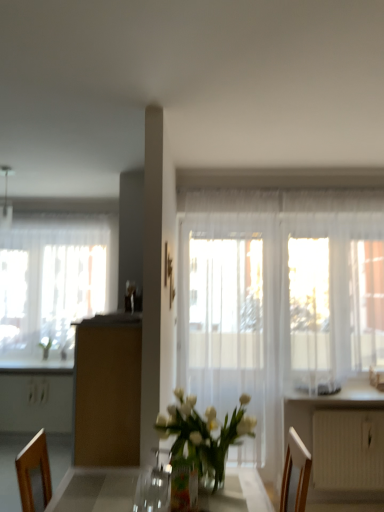
At what (x,y) coordinates should I click in order to perform the action: click on metallic silver lamp at upper left. Please return your answer as a coordinate pair (x, y). Image resolution: width=384 pixels, height=512 pixels. Looking at the image, I should click on (6, 201).

What is the approximate width of white textured radiator at lower right?

3.72 inches.

This screenshot has width=384, height=512. I want to click on white textured radiator at lower right, so click(348, 450).

Image resolution: width=384 pixels, height=512 pixels. What do you see at coordinates (107, 390) in the screenshot? I see `brown matte cabinet at center` at bounding box center [107, 390].

Measure the distance between translucent fabric screen door at center and camera.

translucent fabric screen door at center and camera are 10.46 feet apart from each other.

In order to face translucent glass vase at center, should I rotate leftwards or rightwards?

Turn left approximately 0.604 degrees to face it.

Measure the distance between wooden picture frame at center and camera.

A distance of 2.46 meters exists between wooden picture frame at center and camera.

Image resolution: width=384 pixels, height=512 pixels. What do you see at coordinates (341, 394) in the screenshot? I see `white glossy counter top at lower right` at bounding box center [341, 394].

At what (x,y) coordinates should I click in order to perform the action: click on white glossy counter top at lower right. Please return your answer as a coordinate pair (x, y). The image size is (384, 512). Looking at the image, I should click on (341, 394).

Identify the location of metallic silver lamp at upper left. (6, 201).

Would you say white textured radiator at lower right is a long distance from translucent glass vase at center?

Yes, white textured radiator at lower right and translucent glass vase at center are located far from each other.

Considering the sizes of objects white textured radiator at lower right and translucent glass vase at center in the image provided, who is thinner, white textured radiator at lower right or translucent glass vase at center?

translucent glass vase at center.

Is white textured radiator at lower right taller or shorter than translucent glass vase at center?

white textured radiator at lower right is taller than translucent glass vase at center.

From a real-world perspective, is white textured radiator at lower right physically below translucent glass vase at center?

Yes.

Can we say white glossy counter top at lower right lies outside wooden picture frame at center?

Absolutely, white glossy counter top at lower right is external to wooden picture frame at center.

Which is more to the right, white glossy counter top at lower right or wooden picture frame at center?

From the viewer's perspective, white glossy counter top at lower right appears more on the right side.

In terms of width, does white glossy counter top at lower right look wider or thinner when compared to wooden picture frame at center?

In the image, white glossy counter top at lower right appears to be wider than wooden picture frame at center.

Is metallic silver lamp at upper left positioned with its back to translucent fabric screen door at center?

That's not correct — metallic silver lamp at upper left is not looking away from translucent fabric screen door at center.

Which is in front, metallic silver lamp at upper left or translucent fabric screen door at center?

translucent fabric screen door at center is in front.

From the image's perspective, is metallic silver lamp at upper left above or below translucent fabric screen door at center?

From the image's perspective, metallic silver lamp at upper left appears above translucent fabric screen door at center.

Based on the photo, is metallic silver lamp at upper left beside translucent fabric screen door at center?

They are not placed beside each other.

Is metallic silver lamp at upper left not near white glossy counter top at lower right?

Absolutely, metallic silver lamp at upper left is distant from white glossy counter top at lower right.

From a real-world perspective, who is located lower, metallic silver lamp at upper left or white glossy counter top at lower right?

white glossy counter top at lower right, from a real-world perspective.

Could you tell me if metallic silver lamp at upper left is turned towards white glossy counter top at lower right?

No, metallic silver lamp at upper left is not facing towards white glossy counter top at lower right.

Is the position of metallic silver lamp at upper left less distant than that of white glossy counter top at lower right?

No, metallic silver lamp at upper left is further to the viewer.

Looking at the image, does translucent fabric screen door at center seem bigger or smaller compared to brown matte cabinet at center?

In the image, translucent fabric screen door at center appears to be smaller than brown matte cabinet at center.

Which is in front, point (195, 377) or point (93, 441)?

Positioned in front is point (93, 441).

In the image, is translucent fabric screen door at center on the left side or the right side of brown matte cabinet at center?

translucent fabric screen door at center is positioned on brown matte cabinet at center's right side.

In the scene shown: Is translucent fabric screen door at center far from brown matte cabinet at center?

Yes, translucent fabric screen door at center is far from brown matte cabinet at center.

Considering their positions, is brown matte cabinet at center located in front of or behind wooden picture frame at center?

In the image, brown matte cabinet at center appears in front of wooden picture frame at center.

From a real-world perspective, which object stands above the other?

In real-world perspective, wooden picture frame at center is above.

Which object is positioned more to the right, brown matte cabinet at center or wooden picture frame at center?

From the viewer's perspective, wooden picture frame at center appears more on the right side.

Is brown matte cabinet at center beside wooden picture frame at center?

No, brown matte cabinet at center is not next to wooden picture frame at center.

Which is correct: translucent glass window at left is inside white textured radiator at lower right, or outside of it?

translucent glass window at left exists outside the volume of white textured radiator at lower right.

Is white textured radiator at lower right at the back of translucent glass window at left?

No, translucent glass window at left is not facing the opposite direction of white textured radiator at lower right.

Between translucent glass window at left and white textured radiator at lower right, which one has smaller size?

white textured radiator at lower right.

Are translucent glass window at left and white textured radiator at lower right far apart?

That's right, there is a large distance between translucent glass window at left and white textured radiator at lower right.

At what (x,y) coordinates should I click in order to perform the action: click on radiator beneath the translucent glass vase at center (from a real-world perspective). Please return your answer as a coordinate pair (x, y). The image size is (384, 512). Looking at the image, I should click on (348, 450).

Find the location of a particular element. The width and height of the screenshot is (384, 512). counter top below the wooden picture frame at center (from the image's perspective) is located at coordinates (341, 394).

From the image, which object appears to be nearer to brown matte cabinet at center, translucent glass vase at center or white textured radiator at lower right?

The object closer to brown matte cabinet at center is translucent glass vase at center.

Consider the image. When comparing their distances from white textured radiator at lower right, does translucent fabric screen door at center or brown matte cabinet at center seem closer?

translucent fabric screen door at center.

Estimate the real-world distances between objects in this image. Which object is further from white textured radiator at lower right, metallic silver lamp at upper left or translucent glass vase at center?

metallic silver lamp at upper left.

When comparing their distances from wooden picture frame at center, does metallic silver lamp at upper left or white textured radiator at lower right seem closer?

metallic silver lamp at upper left lies closer to wooden picture frame at center than the other object.

Looking at the image, which one is located closer to translucent glass vase at center, wooden picture frame at center or metallic silver lamp at upper left?

The object closer to translucent glass vase at center is wooden picture frame at center.

Estimate the real-world distances between objects in this image. Which object is further from brown matte cabinet at center, translucent fabric screen door at center or white glossy counter top at lower right?

white glossy counter top at lower right.

Based on their spatial positions, is translucent glass window at left or brown matte cabinet at center further from metallic silver lamp at upper left?

brown matte cabinet at center is further to metallic silver lamp at upper left.

Estimate the real-world distances between objects in this image. Which object is further from metallic silver lamp at upper left, white glossy counter top at lower right or brown matte cabinet at center?

Based on the image, white glossy counter top at lower right appears to be further to metallic silver lamp at upper left.

The width and height of the screenshot is (384, 512). I want to click on cabinetry between metallic silver lamp at upper left and white textured radiator at lower right from left to right, so click(107, 390).

Where is `lamp between translucent glass vase at center and translucent glass window at left from front to back`? The image size is (384, 512). lamp between translucent glass vase at center and translucent glass window at left from front to back is located at coordinates (6, 201).

Image resolution: width=384 pixels, height=512 pixels. Identify the location of cabinetry situated between metallic silver lamp at upper left and white glossy counter top at lower right from left to right. (107, 390).

Where is `picture frame between brown matte cabinet at center and white textured radiator at lower right in the horizontal direction`? The image size is (384, 512). picture frame between brown matte cabinet at center and white textured radiator at lower right in the horizontal direction is located at coordinates (171, 287).